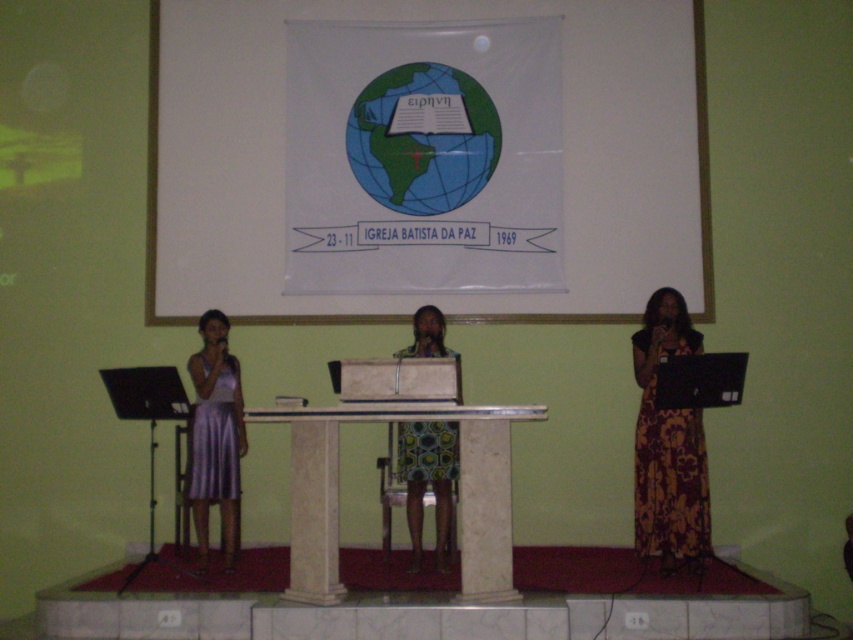
You are an event organizer planning to set up a microphone stand for a speaker. The stand requires at least 1 meter of vertical space. Given the white fabric at center and the white marble table at center, which object will allow the microphone stand to be placed without obstruction?

The white fabric at center is taller than the white marble table at center, so placing the microphone stand near the white fabric at center would provide sufficient vertical space for the stand.

You are sitting in the audience at Igreja Batista da Paz and want to see both the point at position (463, 16) and the point at (415, 449). Which point will appear closer to you?

The point at position (463, 16) is further to the camera than the point at (415, 449), so the point at (415, 449) will appear closer to you.